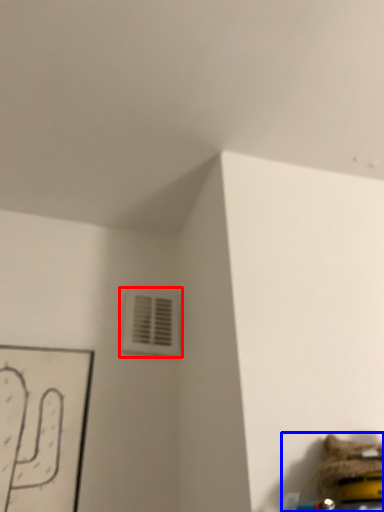
Question: Which of the following is the farthest to the observer, air conditioning (highlighted by a red box) or toy (highlighted by a blue box)?

Choices:
 (A) air conditioning
 (B) toy

Answer: (A)